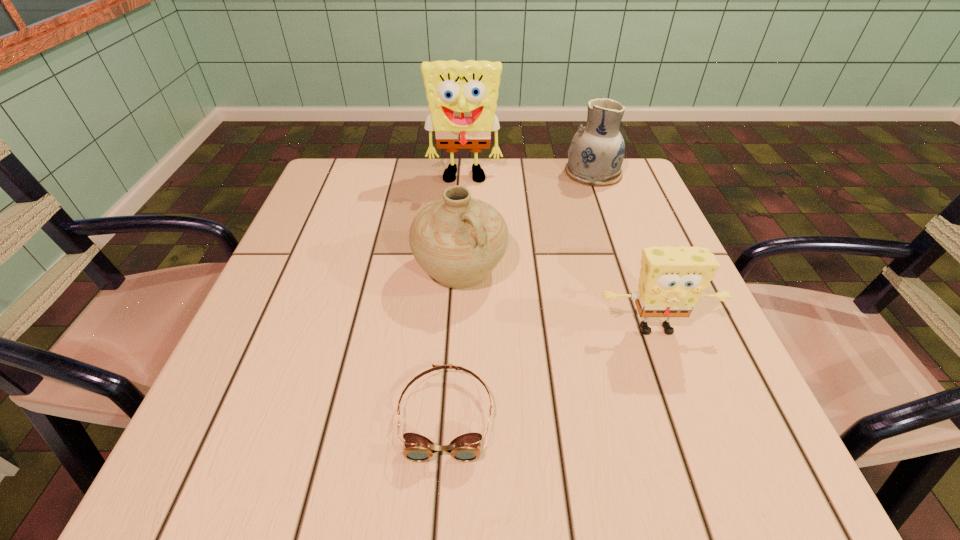
Find the location of a particular element. Image resolution: width=960 pixels, height=540 pixels. the left sponge is located at coordinates (462, 97).

What are the coordinates of `the tallest object` in the screenshot? It's located at (462, 97).

At what (x,y) coordinates should I click in order to perform the action: click on the farther pottery. Please return your answer as a coordinate pair (x, y). Looking at the image, I should click on (595, 155).

You are a GUI agent. You are given a task and a screenshot of the screen. Output one action in this format:
    pyautogui.click(x=<x>, y=<y>)
    Task: Click on the nearer pottery
    The image size is (960, 540).
    Given the screenshot: What is the action you would take?
    pyautogui.click(x=458, y=240)

The height and width of the screenshot is (540, 960). I want to click on the left pottery, so click(x=458, y=240).

At what (x,y) coordinates should I click in order to perform the action: click on the shorter sponge. Please return your answer as a coordinate pair (x, y). The width and height of the screenshot is (960, 540). Looking at the image, I should click on (672, 280).

You are a GUI agent. You are given a task and a screenshot of the screen. Output one action in this format:
    pyautogui.click(x=<x>, y=<y>)
    Task: Click on the nearer sponge
    Image resolution: width=960 pixels, height=540 pixels.
    Given the screenshot: What is the action you would take?
    pyautogui.click(x=672, y=280)

Find the location of `goggles`. goggles is located at coordinates (465, 448).

Identify the location of the nearest object. The height and width of the screenshot is (540, 960). (465, 448).

At what (x,y) coordinates should I click in order to perform the action: click on free spot located on the face of the taller sponge. Please return your answer as a coordinate pair (x, y). Looking at the image, I should click on (460, 266).